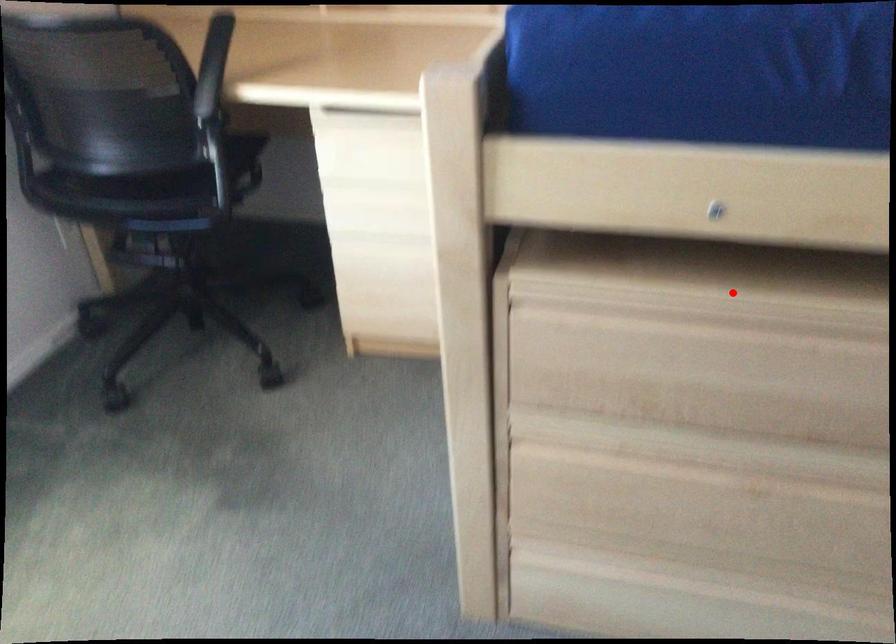
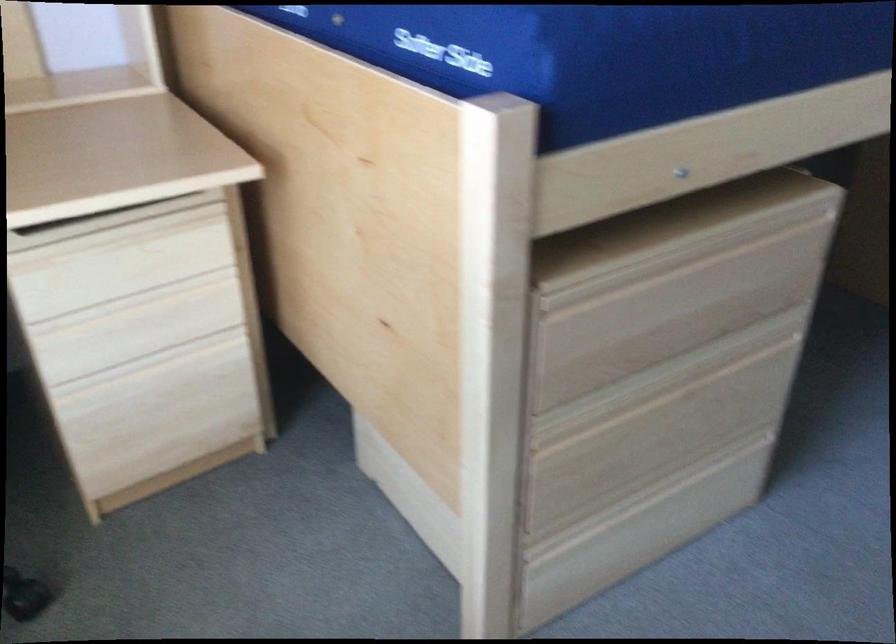
Question: I am providing you with two images of the same scene from different viewpoints. Given a red point in image1, look at the same physical point in image2. Is it:

Choices:
 (A) Closer to the viewpoint
 (B) Farther from the viewpoint

Answer: (B)